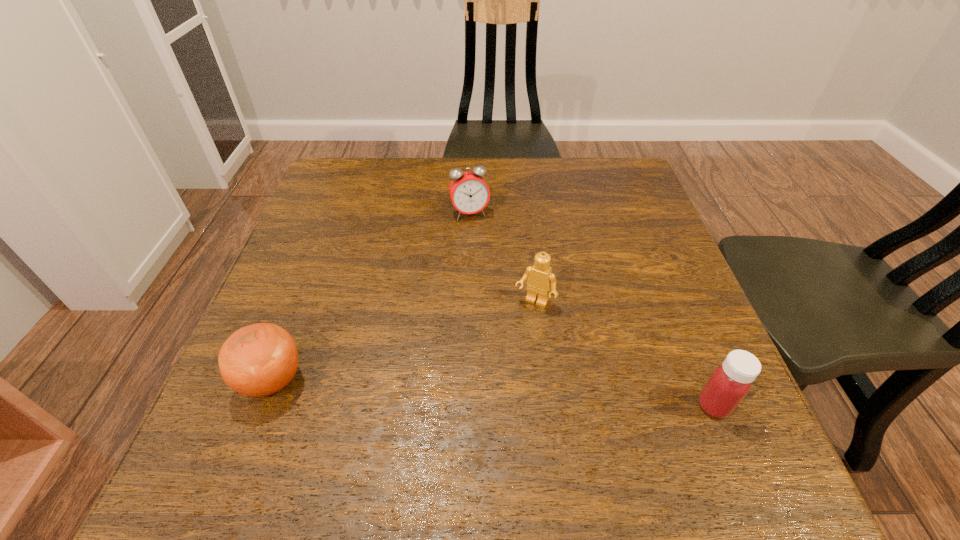
Image resolution: width=960 pixels, height=540 pixels. Identify the location of vacant area between the Lego and the rightmost object. (624, 354).

Where is `free space between the orange and the medicine`? free space between the orange and the medicine is located at coordinates (493, 393).

This screenshot has height=540, width=960. Identify the location of blank region between the third nearest object and the third object from right to left. (502, 258).

The height and width of the screenshot is (540, 960). I want to click on unoccupied position between the orange and the rightmost object, so click(493, 393).

This screenshot has width=960, height=540. In order to click on vacant space in between the second object from right to left and the alarm clock in this screenshot , I will do coord(502,258).

Point out which object is positioned as the nearest to the second object from right to left. Please provide its 2D coordinates. Your answer should be formatted as a tuple, i.e. [(x, y)], where the tuple contains the x and y coordinates of a point satisfying the conditions above.

[(469, 193)]

Locate an element on the screen. the closest object relative to the second object from left to right is located at coordinates (540, 278).

In order to click on blank space that satisfies the following two spatial constraints: 1. on the front side of the leftmost object; 2. on the right side of the medicine in this screenshot , I will do `click(263, 406)`.

At what (x,y) coordinates should I click in order to perform the action: click on vacant area that satisfies the following two spatial constraints: 1. on the front side of the leftmost object; 2. on the right side of the rightmost object. Please return your answer as a coordinate pair (x, y). Looking at the image, I should click on (263, 406).